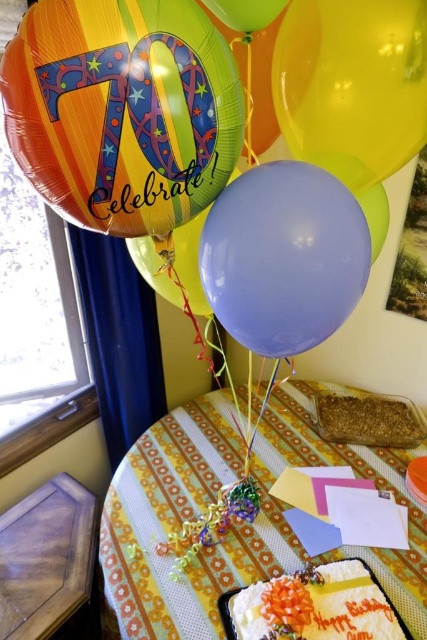
Between multicolored metallic balloon at upper left and yellow fabric tablecloth at lower center, which one has more height?

Standing taller between the two is yellow fabric tablecloth at lower center.

At what (x,y) coordinates should I click in order to perform the action: click on multicolored metallic balloon at upper left. Please return your answer as a coordinate pair (x, y). Looking at the image, I should click on pos(122,109).

Which is behind, point (233, 141) or point (287, 548)?

The point (287, 548) is more distant.

Locate an element on the screen. The image size is (427, 640). multicolored metallic balloon at upper left is located at coordinates (122, 109).

Is multicolored metallic balloon at upper left shorter than translucent yellow balloon at upper right?

Yes.

Based on the photo, between multicolored metallic balloon at upper left and translucent yellow balloon at upper right, which one appears on the left side from the viewer's perspective?

multicolored metallic balloon at upper left

Who is more forward, (119, 65) or (365, 90)?

Point (119, 65)

Where is `multicolored metallic balloon at upper left`? Image resolution: width=427 pixels, height=640 pixels. multicolored metallic balloon at upper left is located at coordinates (122, 109).

Which of these two, matte purple balloon at center or white frosted cake with orange flower at center, stands shorter?

Standing shorter between the two is white frosted cake with orange flower at center.

Describe the element at coordinates (283, 257) in the screenshot. This screenshot has height=640, width=427. I see `matte purple balloon at center` at that location.

Where is `matte purple balloon at center`? matte purple balloon at center is located at coordinates (283, 257).